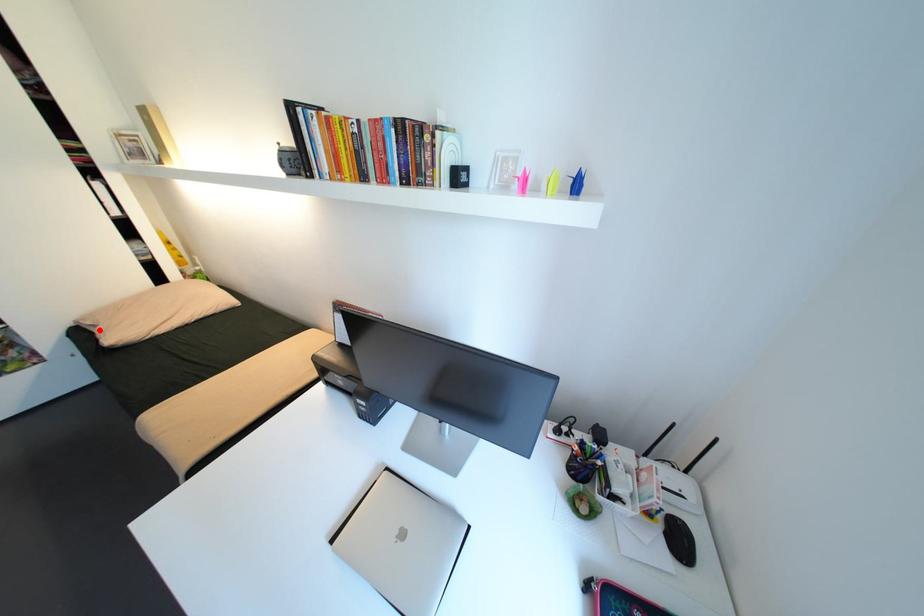
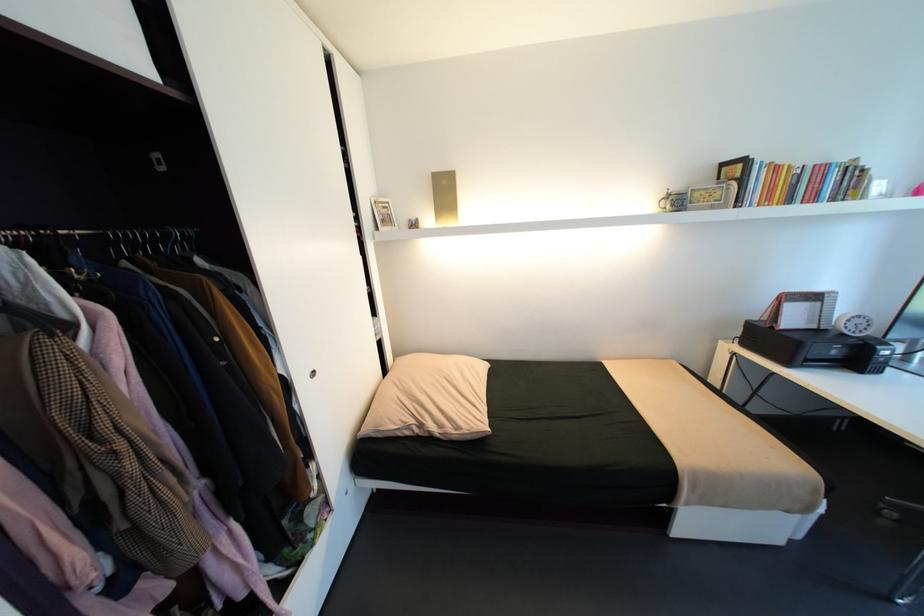
The point at the highlighted location is marked in the first image. Where is the corresponding point in the second image?

(415, 432)